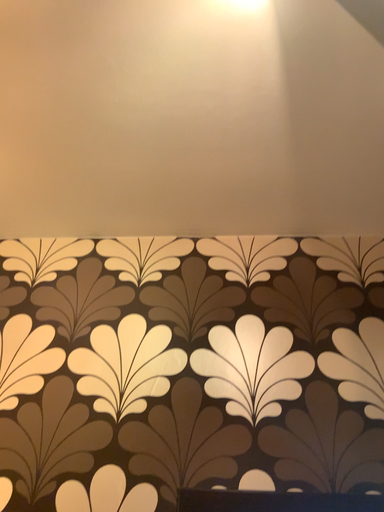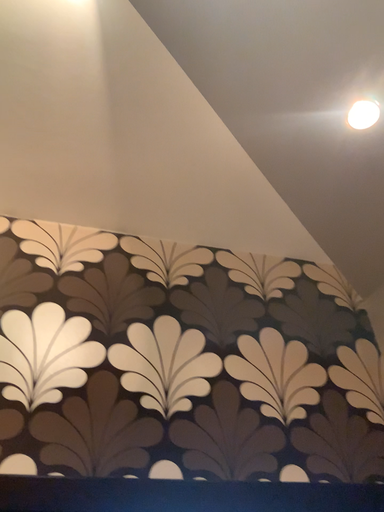
Question: Which way did the camera rotate in the video?

Choices:
 (A) rotated left
 (B) rotated right

Answer: (B)